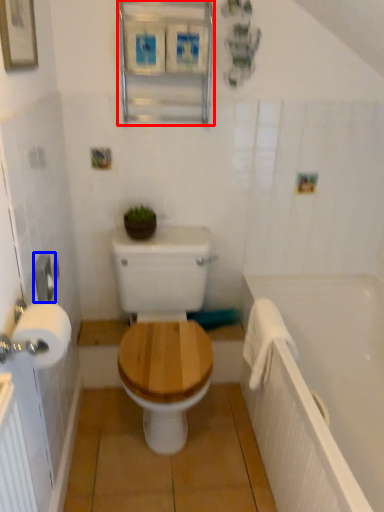
Question: Which object appears closest to the camera in this image, medicine cabinet (highlighted by a red box) or towel bar (highlighted by a blue box)?

Choices:
 (A) medicine cabinet
 (B) towel bar

Answer: (B)